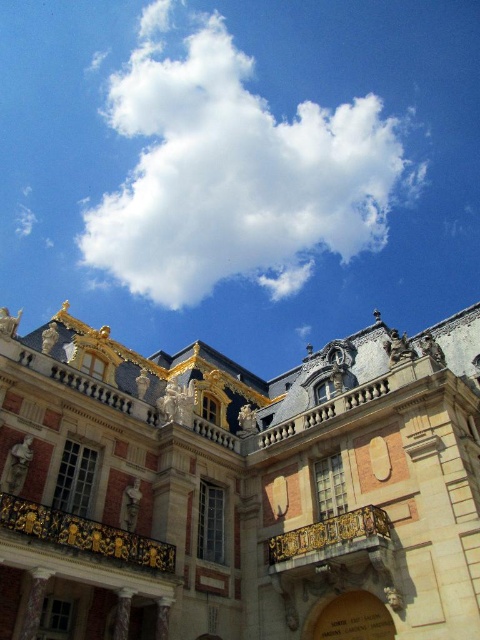
You are an architect reviewing the design of the building. You notice the white fluffy cloud at upper center and the gold ornate balcony at center. Which object is located above the other?

The white fluffy cloud at upper center is positioned over the gold ornate balcony at center, meaning the cloud is above the balcony.

You are an architect analyzing the building depicted in the image. You notice the white fluffy cloud at upper center and the gold ornate railing at center. Which of these two objects is positioned higher in the scene?

The white fluffy cloud at upper center is positioned higher than the gold ornate railing at center.

You are standing in front of a grand building with a white fluffy cloud at upper center. You want to take a photo of the building with the cloud in the background. If your camera can only focus on objects within 200 meters, will the cloud be in focus?

The white fluffy cloud at upper center is 259.42 meters away from camera, so it will not be in focus since it is beyond the camera focus range of 200 meters.